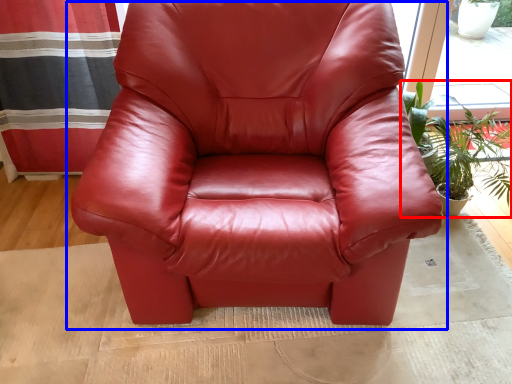
Question: Which of the following is the closest to the observer, houseplant (highlighted by a red box) or chair (highlighted by a blue box)?

Choices:
 (A) houseplant
 (B) chair

Answer: (B)